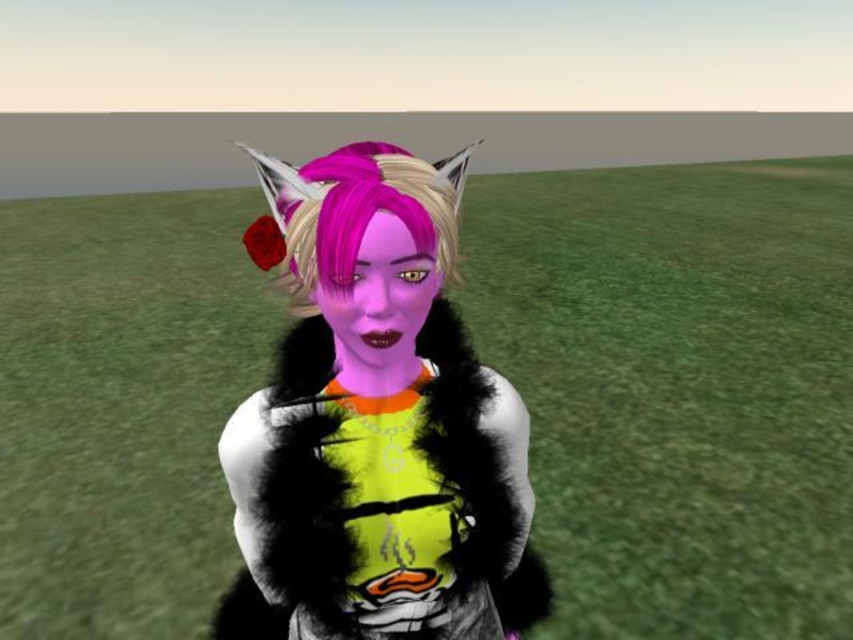
Who is positioned more to the left, fuzzy fur vest at center or pink matte hair at center?

fuzzy fur vest at center is more to the left.

Is fuzzy fur vest at center to the left of pink matte hair at center from the viewer's perspective?

Indeed, fuzzy fur vest at center is positioned on the left side of pink matte hair at center.

Locate an element on the screen. Image resolution: width=853 pixels, height=640 pixels. fuzzy fur vest at center is located at coordinates (375, 422).